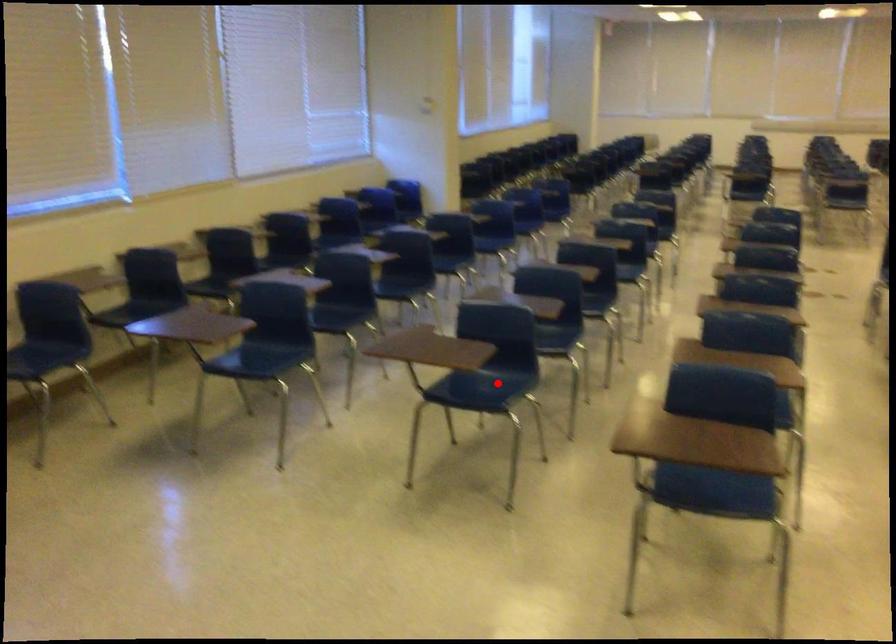
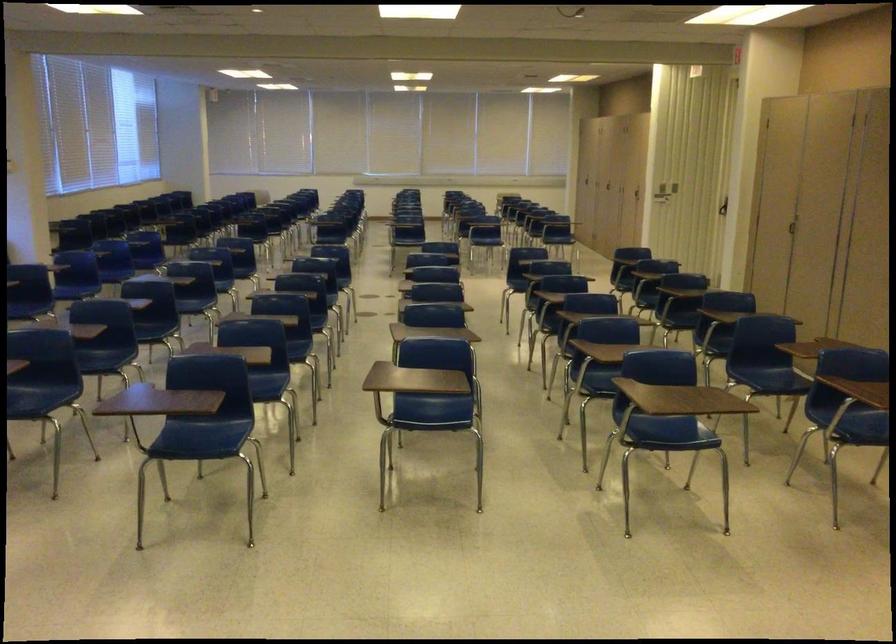
Where in the second image is the point corresponding to the highlighted location from the first image?

(39, 395)